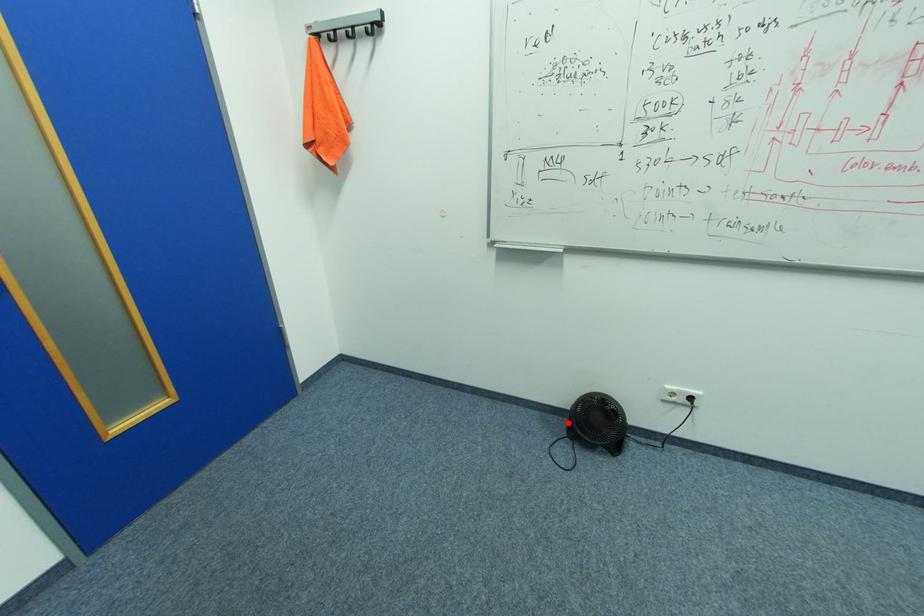
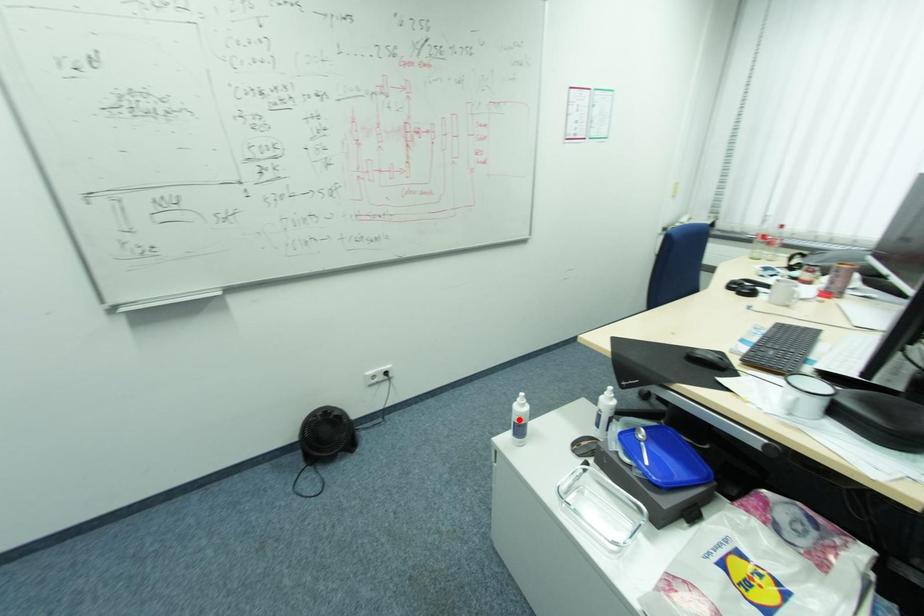
I am providing you with two images of the same scene from different viewpoints. A red point is marked on the first image and another point is marked on the second image. Is the marked point in image1 the same physical position as the marked point in image2?

No